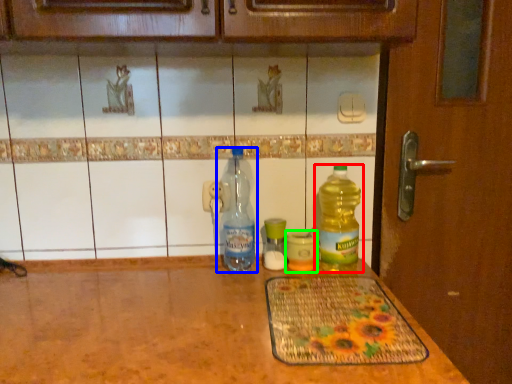
Question: Considering the real-world distances, which object is farthest from bottle (highlighted by a red box)? bottle (highlighted by a blue box) or bottle (highlighted by a green box)?

Choices:
 (A) bottle
 (B) bottle

Answer: (A)